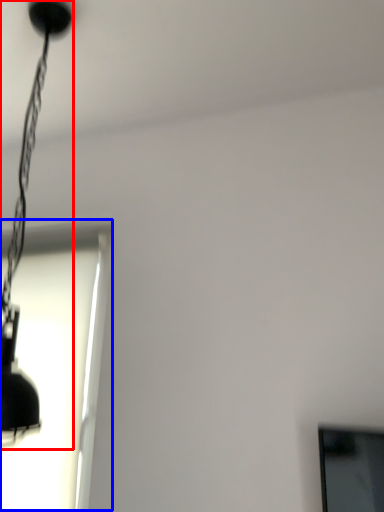
Question: Which point is further to the camera, lamp (highlighted by a red box) or window (highlighted by a blue box)?

Choices:
 (A) lamp
 (B) window

Answer: (B)